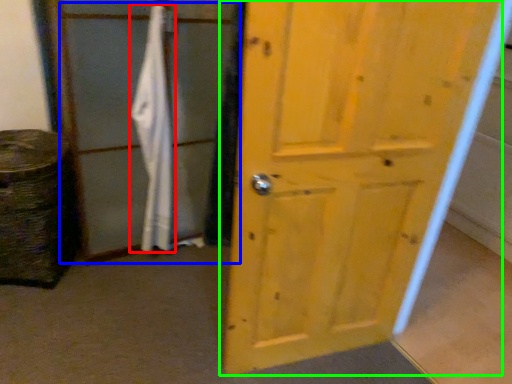
Question: Estimate the real-world distances between objects in this image. Which object is farther from bath towel (highlighted by a red box), screen door (highlighted by a blue box) or door (highlighted by a green box)?

Choices:
 (A) screen door
 (B) door

Answer: (B)